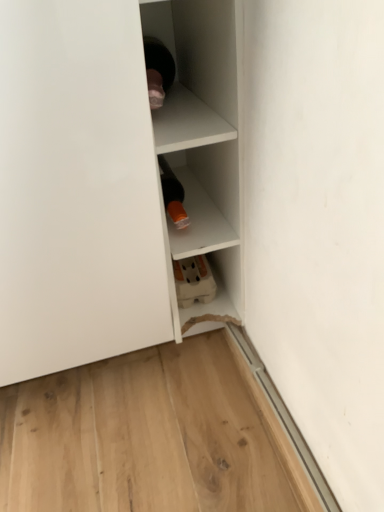
What is the approximate width of white matte shelf at upper left, the 1th shelf positioned from the left?

The width of white matte shelf at upper left, the 1th shelf positioned from the left, is 77.00 centimeters.

What do you see at coordinates (113, 177) in the screenshot? Image resolution: width=384 pixels, height=512 pixels. I see `white matte shelf at upper left, the 2th shelf positioned from the right` at bounding box center [113, 177].

Where is `white matte shelf at upper left, the 1th shelf positioned from the left`? The width and height of the screenshot is (384, 512). white matte shelf at upper left, the 1th shelf positioned from the left is located at coordinates (113, 177).

What do you see at coordinates (203, 146) in the screenshot?
I see `white matte shelf at center, positioned as the 1th shelf in right-to-left order` at bounding box center [203, 146].

At what (x,y) coordinates should I click in order to perform the action: click on white matte shelf at center, which appears as the second shelf when viewed from the left. Please return your answer as a coordinate pair (x, y). Looking at the image, I should click on (203, 146).

Measure the distance between point (x=194, y=232) and camera.

Point (x=194, y=232) and camera are 32.01 inches apart from each other.

Identify the location of white matte shelf at upper left, the 1th shelf positioned from the left. (113, 177).

Is white matte shelf at center, positioned as the 1th shelf in right-to-left order, at the right side of white matte shelf at upper left, the 1th shelf positioned from the left?

Correct, you'll find white matte shelf at center, positioned as the 1th shelf in right-to-left order, to the right of white matte shelf at upper left, the 1th shelf positioned from the left.

Is the position of white matte shelf at center, positioned as the 1th shelf in right-to-left order, more distant than that of white matte shelf at upper left, the 2th shelf positioned from the right?

That is True.

Considering the points (202, 106) and (143, 234), which point is behind, point (202, 106) or point (143, 234)?

The point (202, 106) is farther from the camera.

From the image's perspective, is white matte shelf at center, positioned as the 1th shelf in right-to-left order, above or below white matte shelf at upper left, the 2th shelf positioned from the right?

white matte shelf at center, positioned as the 1th shelf in right-to-left order, is situated higher than white matte shelf at upper left, the 2th shelf positioned from the right, in the image.

From a real-world perspective, is white matte shelf at center, positioned as the 1th shelf in right-to-left order, above or below white matte shelf at upper left, the 2th shelf positioned from the right?

white matte shelf at center, positioned as the 1th shelf in right-to-left order, is situated lower than white matte shelf at upper left, the 2th shelf positioned from the right, in the real world.

Is white matte shelf at center, positioned as the 1th shelf in right-to-left order, wider or thinner than white matte shelf at upper left, the 2th shelf positioned from the right?

white matte shelf at center, positioned as the 1th shelf in right-to-left order, is thinner than white matte shelf at upper left, the 2th shelf positioned from the right.

Does white matte shelf at center, which appears as the second shelf when viewed from the left, have a lesser height compared to white matte shelf at upper left, the 2th shelf positioned from the right?

No, white matte shelf at center, which appears as the second shelf when viewed from the left, is not shorter than white matte shelf at upper left, the 2th shelf positioned from the right.

Is white matte shelf at center, which appears as the second shelf when viewed from the left, bigger or smaller than white matte shelf at upper left, the 1th shelf positioned from the left?

white matte shelf at center, which appears as the second shelf when viewed from the left, is smaller than white matte shelf at upper left, the 1th shelf positioned from the left.

Is white matte shelf at center, which appears as the second shelf when viewed from the left, positioned beyond the bounds of white matte shelf at upper left, the 2th shelf positioned from the right?

Absolutely, white matte shelf at center, which appears as the second shelf when viewed from the left, is external to white matte shelf at upper left, the 2th shelf positioned from the right.

Is white matte shelf at center, positioned as the 1th shelf in right-to-left order, with white matte shelf at upper left, the 2th shelf positioned from the right?

Yes, white matte shelf at center, positioned as the 1th shelf in right-to-left order, is in contact with white matte shelf at upper left, the 2th shelf positioned from the right.

Is white matte shelf at upper left, the 2th shelf positioned from the right, at the back of white matte shelf at center, positioned as the 1th shelf in right-to-left order?

No, white matte shelf at center, positioned as the 1th shelf in right-to-left order, is not facing the opposite direction of white matte shelf at upper left, the 2th shelf positioned from the right.

How many degrees apart are the facing directions of white matte shelf at center, which appears as the second shelf when viewed from the left, and white matte shelf at upper left, the 1th shelf positioned from the left?

They differ by 0.433 degrees in their facing directions.

Locate an element on the screen. The width and height of the screenshot is (384, 512). shelf that is on the right side of white matte shelf at upper left, the 1th shelf positioned from the left is located at coordinates (203, 146).

Which is more to the right, white matte shelf at upper left, the 1th shelf positioned from the left, or white matte shelf at center, positioned as the 1th shelf in right-to-left order?

Positioned to the right is white matte shelf at center, positioned as the 1th shelf in right-to-left order.

Does white matte shelf at upper left, the 1th shelf positioned from the left, come in front of white matte shelf at center, which appears as the second shelf when viewed from the left?

Yes, the depth of white matte shelf at upper left, the 1th shelf positioned from the left, is less than that of white matte shelf at center, which appears as the second shelf when viewed from the left.

Is point (240, 232) farther from camera compared to point (160, 117)?

Yes, point (240, 232) is behind point (160, 117).

From the image's perspective, would you say white matte shelf at upper left, the 2th shelf positioned from the right, is positioned over white matte shelf at center, positioned as the 1th shelf in right-to-left order?

Actually, white matte shelf at upper left, the 2th shelf positioned from the right, appears below white matte shelf at center, positioned as the 1th shelf in right-to-left order, in the image.

From a real-world perspective, who is located higher, white matte shelf at upper left, the 1th shelf positioned from the left, or white matte shelf at center, which appears as the second shelf when viewed from the left?

white matte shelf at upper left, the 1th shelf positioned from the left.

Looking at this image, considering the sizes of objects white matte shelf at upper left, the 1th shelf positioned from the left, and white matte shelf at center, which appears as the second shelf when viewed from the left, in the image provided, who is thinner, white matte shelf at upper left, the 1th shelf positioned from the left, or white matte shelf at center, which appears as the second shelf when viewed from the left,?

white matte shelf at center, which appears as the second shelf when viewed from the left, is thinner.

Considering the relative sizes of white matte shelf at upper left, the 2th shelf positioned from the right, and white matte shelf at center, which appears as the second shelf when viewed from the left, in the image provided, is white matte shelf at upper left, the 2th shelf positioned from the right, taller than white matte shelf at center, which appears as the second shelf when viewed from the left,?

No.

In terms of size, does white matte shelf at upper left, the 2th shelf positioned from the right, appear bigger or smaller than white matte shelf at center, positioned as the 1th shelf in right-to-left order?

Clearly, white matte shelf at upper left, the 2th shelf positioned from the right, is larger in size than white matte shelf at center, positioned as the 1th shelf in right-to-left order.

Could white matte shelf at center, which appears as the second shelf when viewed from the left, be considered to be inside white matte shelf at upper left, the 2th shelf positioned from the right?

No, white matte shelf at center, which appears as the second shelf when viewed from the left, is not surrounded by white matte shelf at upper left, the 2th shelf positioned from the right.

Is white matte shelf at upper left, the 2th shelf positioned from the right, far from white matte shelf at center, which appears as the second shelf when viewed from the left?

No.

Is white matte shelf at upper left, the 1th shelf positioned from the left, facing towards white matte shelf at center, which appears as the second shelf when viewed from the left?

No, white matte shelf at upper left, the 1th shelf positioned from the left, is not aimed at white matte shelf at center, which appears as the second shelf when viewed from the left.

Measure the distance from white matte shelf at upper left, the 1th shelf positioned from the left, to white matte shelf at center, which appears as the second shelf when viewed from the left.

white matte shelf at upper left, the 1th shelf positioned from the left, is 2.46 inches away from white matte shelf at center, which appears as the second shelf when viewed from the left.

Where is `shelf that is above the white matte shelf at upper left, the 1th shelf positioned from the left (from the image's perspective)`? shelf that is above the white matte shelf at upper left, the 1th shelf positioned from the left (from the image's perspective) is located at coordinates (203, 146).

This screenshot has height=512, width=384. Find the location of `shelf in front of the white matte shelf at center, positioned as the 1th shelf in right-to-left order`. shelf in front of the white matte shelf at center, positioned as the 1th shelf in right-to-left order is located at coordinates [x=113, y=177].

At what (x,y) coordinates should I click in order to perform the action: click on shelf on the left side of white matte shelf at center, positioned as the 1th shelf in right-to-left order. Please return your answer as a coordinate pair (x, y). Looking at the image, I should click on (113, 177).